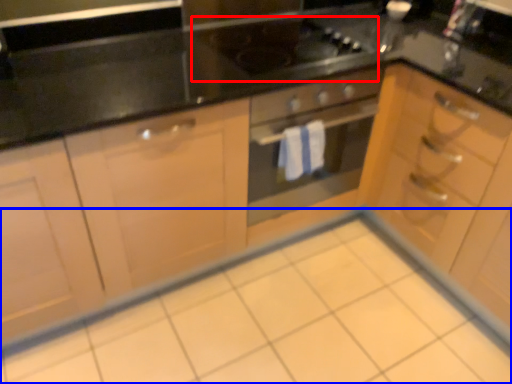
Question: Which object appears farthest to the camera in this image, gas stove (highlighted by a red box) or ceramic tile (highlighted by a blue box)?

Choices:
 (A) gas stove
 (B) ceramic tile

Answer: (A)